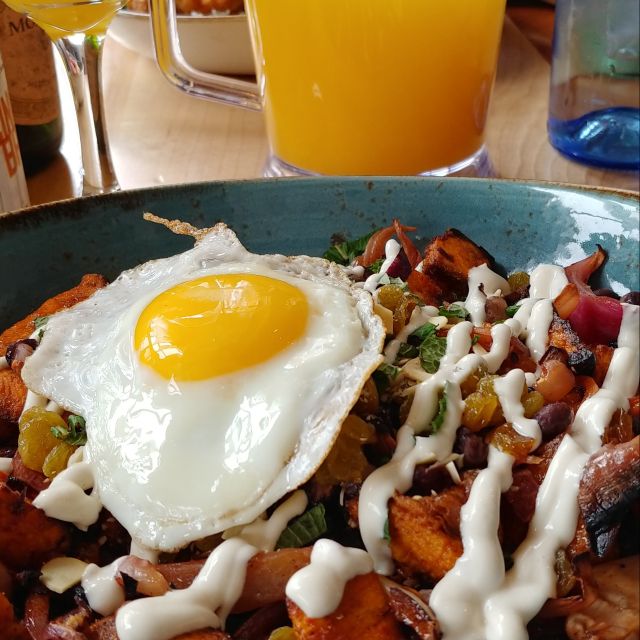
The height and width of the screenshot is (640, 640). I want to click on bottles, so click(x=33, y=75).